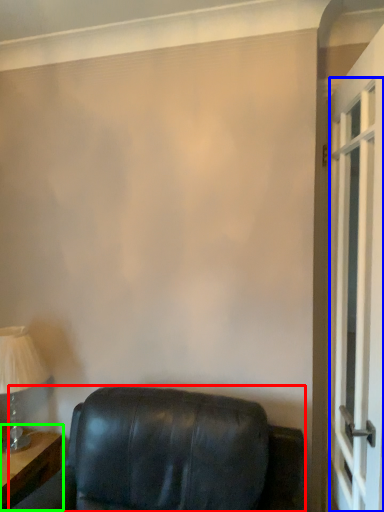
Question: Which object is positioned farthest from furniture (highlighted by a red box)? Select from screen door (highlighted by a blue box) and table (highlighted by a green box).

Choices:
 (A) screen door
 (B) table

Answer: (A)